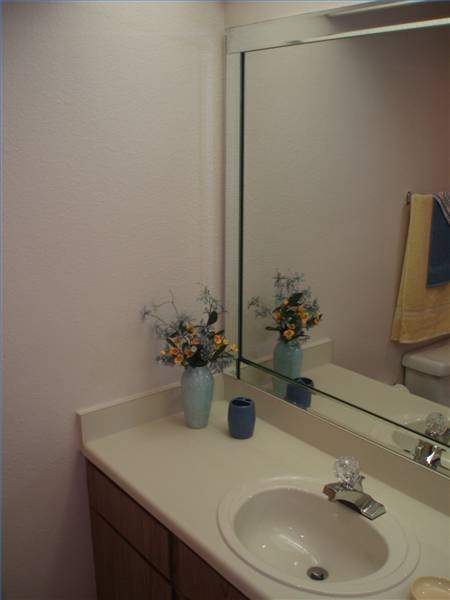
In order to click on mirror in this screenshot , I will do `click(356, 332)`.